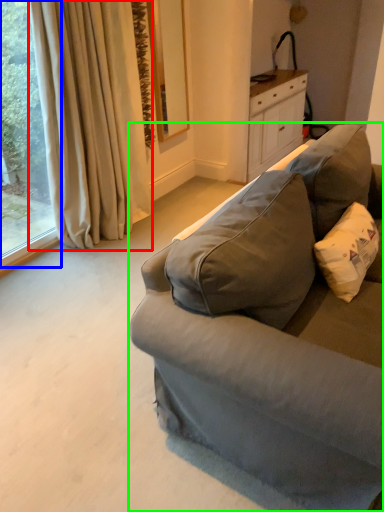
Question: Which is nearer to the curtain (highlighted by a red box)? window (highlighted by a blue box) or studio couch (highlighted by a green box).

Choices:
 (A) window
 (B) studio couch

Answer: (A)